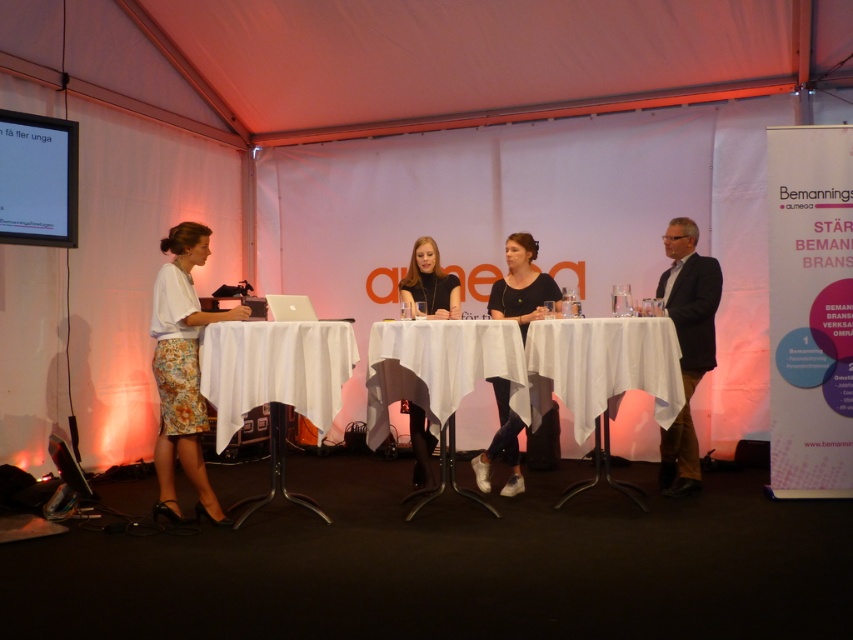
Is white cloth-covered table at center bigger than black matte dress at center?

Yes.

Between point (277, 394) and point (428, 275), which one is positioned behind?

The point (428, 275) is behind.

Locate an element on the screen. The height and width of the screenshot is (640, 853). white cloth-covered table at center is located at coordinates (276, 384).

Is point (589, 355) more distant than point (438, 289)?

No, (589, 355) is in front of (438, 289).

Which is in front, point (654, 330) or point (413, 246)?

Point (654, 330)

Find the location of `white cloth table at center`. white cloth table at center is located at coordinates (602, 376).

Between white cloth-covered table at center and white fabric table at center, which one has less height?

Standing shorter between the two is white fabric table at center.

Is point (265, 352) behind point (440, 488)?

No.

The image size is (853, 640). Find the location of `white cloth-covered table at center`. white cloth-covered table at center is located at coordinates (276, 384).

I want to click on white cloth-covered table at center, so click(276, 384).